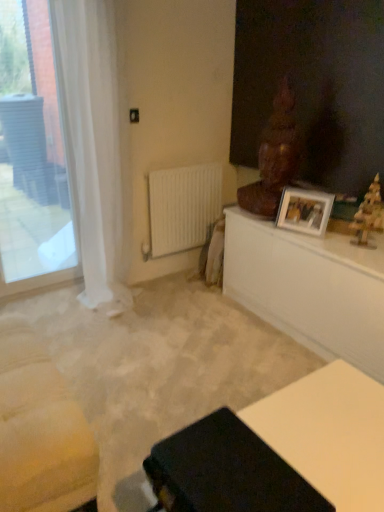
Identify the location of free space above matte black table at lower center, marked as the second table in a back-to-front arrangement (from a real-world perspective). Image resolution: width=384 pixels, height=512 pixels. (321, 432).